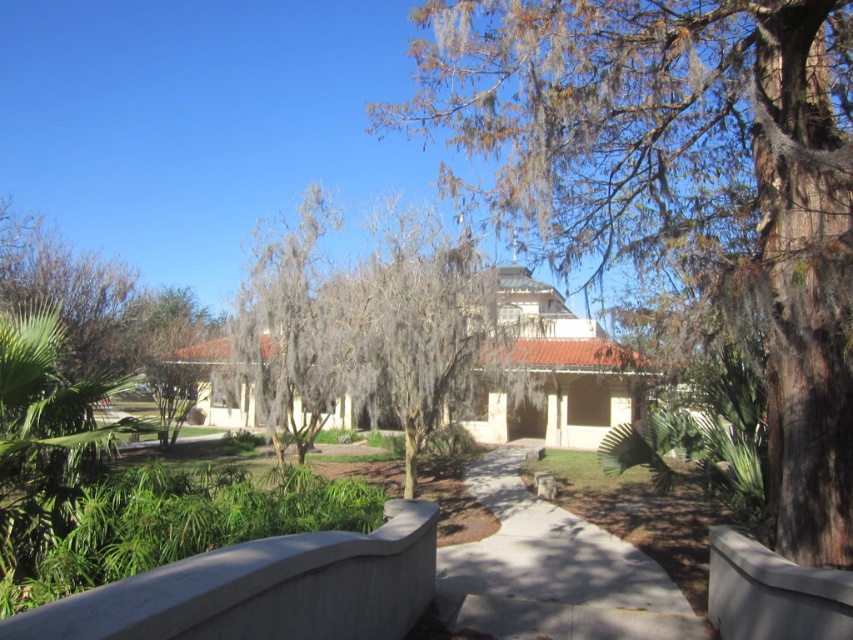
You are standing on the paved walkway and want to take a photo of both the brown textured tree at upper center and the gray mossy tree at center. Which tree should you focus on first to ensure both are in the frame?

You should focus on the gray mossy tree at center first because the brown textured tree at upper center is positioned over it, meaning the gray mossy tree is closer to you and the brown textured tree is further back. This way, adjusting your camera to include both would require framing from the closer object outward.

You are standing at the entrance of the park and see the brown textured tree at upper center. If you walk straight ahead along the path, will you eventually see the building behind the tree?

Yes, because the brown textured tree at upper center is positioned at point (680, 180), which is in the upper part of the scene, so walking straight ahead along the path would allow you to see the building behind it.

You are standing at the entrance of the park and see the brown textured tree at upper center and the gray mossy tree at center. Which tree would block your view of the other if you were to walk straight ahead?

The brown textured tree at upper center is in front of the gray mossy tree at center, so it would block your view of the gray mossy tree at center as you walk straight ahead.